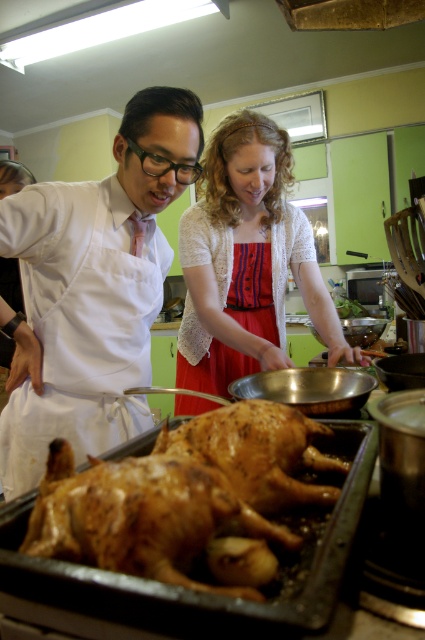
Question: Which of these objects is positioned farthest from the red lace apron at center?

Choices:
 (A) golden crispy chicken at center
 (B) red satin dress at center
 (C) golden crispy skin at center
 (D) white apron at left

Answer: (A)

Question: Is the position of golden crispy skin at center less distant than that of red lace apron at center?

Choices:
 (A) yes
 (B) no

Answer: (A)

Question: Which point is closer to the camera taking this photo?

Choices:
 (A) (175, 403)
 (B) (226, 173)
 (C) (181, 492)

Answer: (C)

Question: Can you confirm if white apron at left is positioned to the right of red satin dress at center?

Choices:
 (A) yes
 (B) no

Answer: (B)

Question: Which is nearer to the red satin dress at center?

Choices:
 (A) red lace apron at center
 (B) golden crispy chicken at center
 (C) white apron at left

Answer: (A)

Question: Is golden crispy chicken at center above red satin dress at center?

Choices:
 (A) no
 (B) yes

Answer: (A)